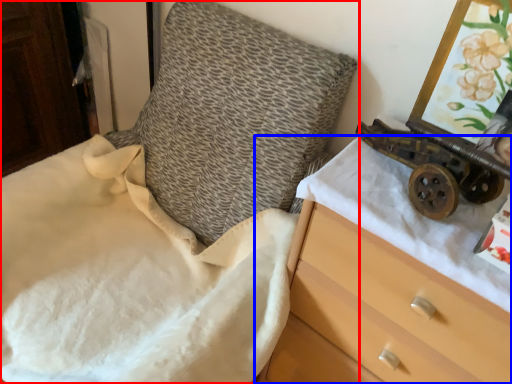
Question: Among these objects, which one is farthest to the camera, furniture (highlighted by a red box) or chest of drawers (highlighted by a blue box)?

Choices:
 (A) furniture
 (B) chest of drawers

Answer: (B)